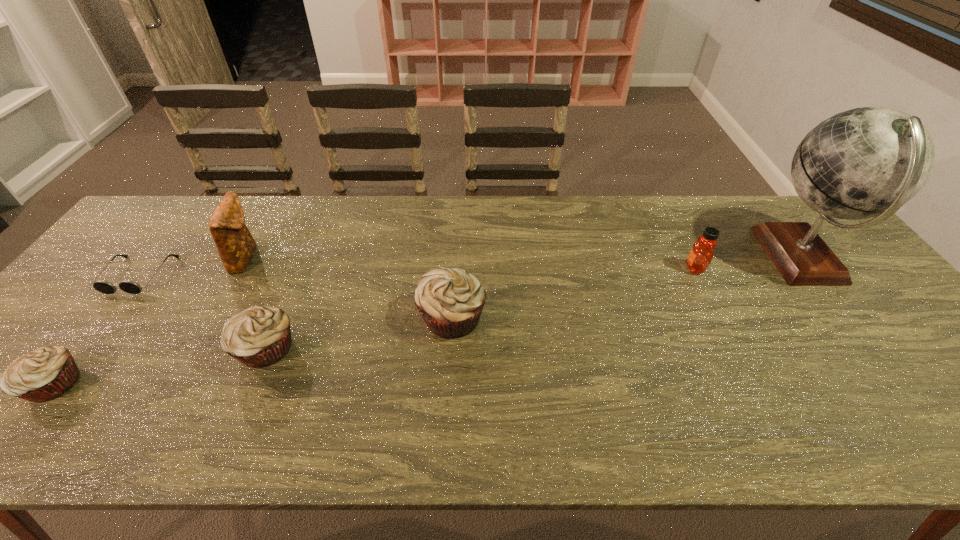
Locate an element on the screen. Image resolution: width=960 pixels, height=540 pixels. vacant space located at the equator of the rightmost object is located at coordinates 660,258.

Where is `vacant space situated 0.170m on the open side of the fifth object from right to left`? vacant space situated 0.170m on the open side of the fifth object from right to left is located at coordinates (317, 258).

Where is `globe at the far edge`? The width and height of the screenshot is (960, 540). globe at the far edge is located at coordinates (866, 162).

Where is `clutch bag at the far edge`? Image resolution: width=960 pixels, height=540 pixels. clutch bag at the far edge is located at coordinates (236, 246).

You are a GUI agent. You are given a task and a screenshot of the screen. Output one action in this format:
    pyautogui.click(x=<x>, y=<y>)
    Task: Click on the muffin at the left edge
    This screenshot has height=540, width=960.
    Given the screenshot: What is the action you would take?
    pyautogui.click(x=44, y=374)

Find the location of a particular element. sunglasses located in the left edge section of the desktop is located at coordinates (127, 286).

This screenshot has height=540, width=960. I want to click on object that is at the right edge, so click(866, 162).

The height and width of the screenshot is (540, 960). What are the coordinates of `object that is at the near left corner` in the screenshot? It's located at (44, 374).

Locate an element on the screen. object that is at the far right corner is located at coordinates (866, 162).

Find the location of `free region at the far edge of the desktop`. free region at the far edge of the desktop is located at coordinates (560, 195).